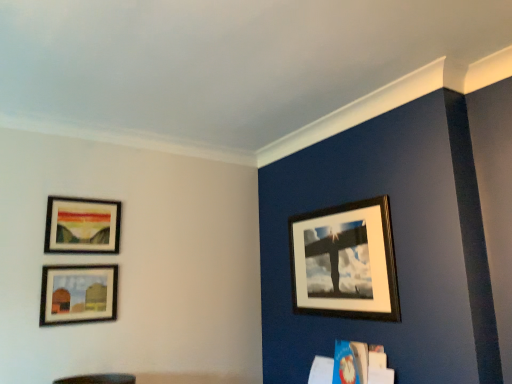
Question: Is matte wooden picture frame at upper left, the 3th picture frame in the right-to-left sequence, taller or shorter than matte wooden picture frame at lower left, the 2th picture frame viewed from the left?

Choices:
 (A) tall
 (B) short

Answer: (A)

Question: Is point (108, 230) positioned closer to the camera than point (93, 299)?

Choices:
 (A) closer
 (B) farther

Answer: (B)

Question: Which object is the farthest from the matte wooden picture frame at upper left, the 3th picture frame in the right-to-left sequence?

Choices:
 (A) wooden picture frame at upper right, the 1th picture frame positioned from the right
 (B) matte wooden picture frame at lower left, the 2th picture frame viewed from the left

Answer: (A)

Question: Based on their relative distances, which object is farther from the matte wooden picture frame at lower left, the 2th picture frame viewed from the left?

Choices:
 (A) matte wooden picture frame at upper left, the 1th picture frame viewed from the left
 (B) wooden picture frame at upper right, the 3th picture frame viewed from the left

Answer: (B)